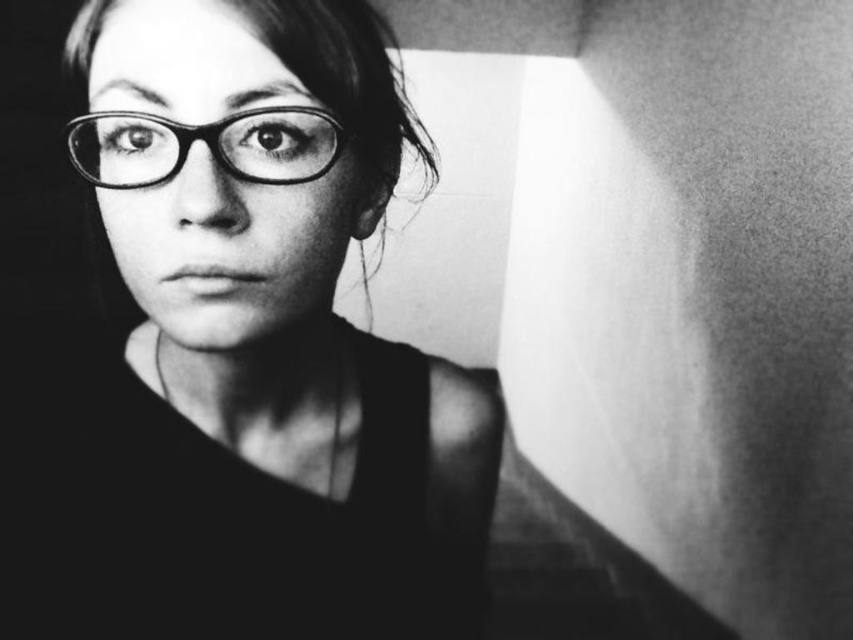
Question: Which point is farther to the camera?

Choices:
 (A) matte black glasses at upper left
 (B) matte black glasses at center

Answer: (B)

Question: Is matte black glasses at upper left below matte black glasses at center?

Choices:
 (A) yes
 (B) no

Answer: (A)

Question: Does matte black glasses at upper left have a greater width compared to matte black glasses at center?

Choices:
 (A) yes
 (B) no

Answer: (A)

Question: Among these objects, which one is farthest from the camera?

Choices:
 (A) matte black glasses at upper left
 (B) matte black glasses at center

Answer: (B)

Question: Is matte black glasses at upper left wider than matte black glasses at center?

Choices:
 (A) yes
 (B) no

Answer: (A)